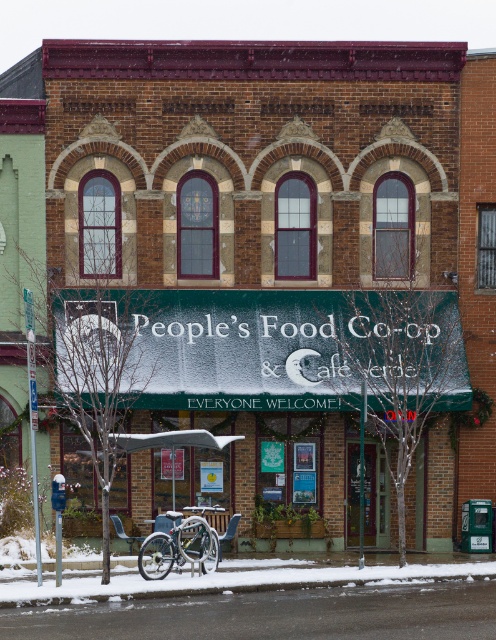
Question: Is white powdery snow at lower center positioned at the back of silver metallic bicycle at lower center?

Choices:
 (A) yes
 (B) no

Answer: (B)

Question: Is white powdery snow at lower center bigger than silver metallic bicycle at lower center?

Choices:
 (A) no
 (B) yes

Answer: (A)

Question: Is white powdery snow at lower center closer to camera compared to silver metallic bicycle at lower center?

Choices:
 (A) yes
 (B) no

Answer: (A)